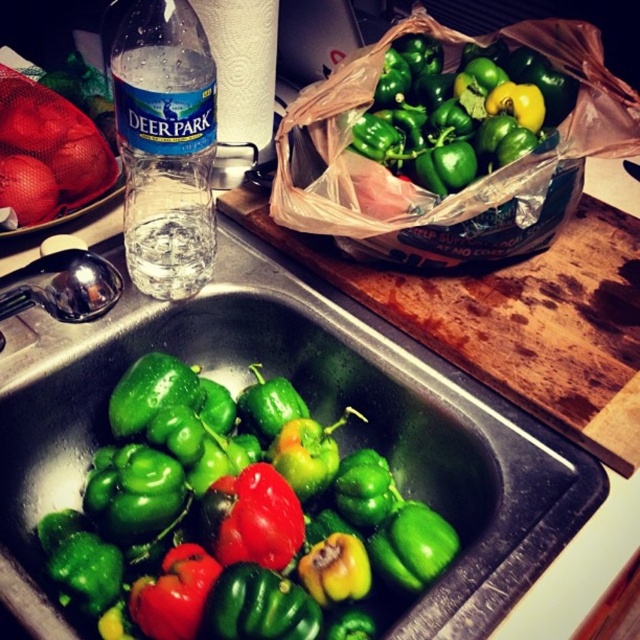
Question: Which object appears closest to the camera in this image?

Choices:
 (A) transparent plastic water bottle at left
 (B) green matte bell pepper at upper center
 (C) green matte peppers at lower left

Answer: (C)

Question: Which object is the farthest from the translucent plastic bag at upper center?

Choices:
 (A) green matte bell pepper at upper center
 (B) transparent plastic water bottle at left
 (C) green matte peppers at lower left

Answer: (B)

Question: Can you confirm if translucent plastic bag at upper center is wider than green matte bell pepper at upper center?

Choices:
 (A) no
 (B) yes

Answer: (B)

Question: Can you confirm if green matte bell pepper at sink is thinner than green matte bell pepper at upper center?

Choices:
 (A) yes
 (B) no

Answer: (B)

Question: Which point appears closest to the camera in this image?

Choices:
 (A) (340, 497)
 (B) (515, 531)
 (C) (465, 104)

Answer: (B)

Question: Is green matte peppers at lower left below green matte bell pepper at sink?

Choices:
 (A) yes
 (B) no

Answer: (B)